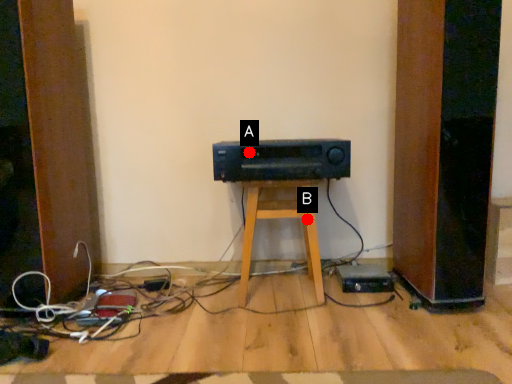
Question: Two points are circled on the image, labeled by A and B beside each circle. Which of the following is the closest to the observer?

Choices:
 (A) A is closer
 (B) B is closer

Answer: (A)